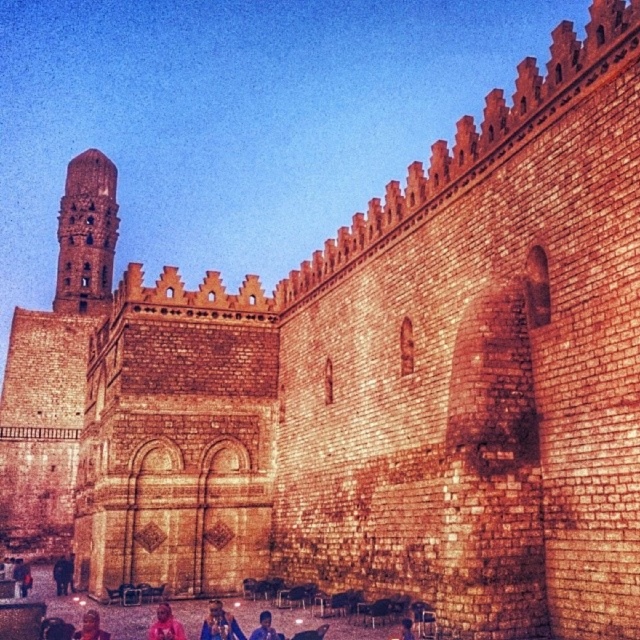
Is smooth skin person at lower left to the right of blue denim jacket at lower center from the viewer's perspective?

Incorrect, smooth skin person at lower left is not on the right side of blue denim jacket at lower center.

Between smooth skin person at lower left and blue denim jacket at lower center, which one has more height?

smooth skin person at lower left

Describe the element at coordinates (61, 573) in the screenshot. I see `smooth skin person at lower left` at that location.

At what (x,y) coordinates should I click in order to perform the action: click on smooth skin person at lower left. Please return your answer as a coordinate pair (x, y). Image resolution: width=640 pixels, height=640 pixels. Looking at the image, I should click on (61, 573).

Is blue denim jeans at lower center closer to the viewer compared to blue denim jacket at lower center?

That is False.

Does blue denim jeans at lower center appear on the right side of blue denim jacket at lower center?

In fact, blue denim jeans at lower center is to the left of blue denim jacket at lower center.

What do you see at coordinates (220, 624) in the screenshot?
I see `blue denim jeans at lower center` at bounding box center [220, 624].

Locate an element on the screen. The height and width of the screenshot is (640, 640). blue denim jeans at lower center is located at coordinates (220, 624).

Is blue denim jeans at lower center smaller than blue fabric shirt at lower center?

No, blue denim jeans at lower center is not smaller than blue fabric shirt at lower center.

Does blue denim jeans at lower center come behind blue fabric shirt at lower center?

Yes.

The image size is (640, 640). In order to click on blue denim jeans at lower center in this screenshot , I will do `click(220, 624)`.